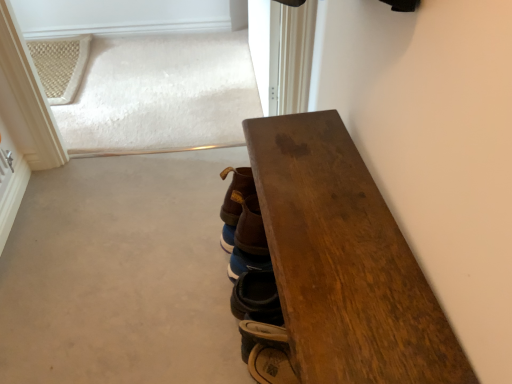
Question: From the image's perspective, is wooden table at right located above or below brown leather boot at lower center, which ranks as the 2th footwear in top-to-bottom order?

Choices:
 (A) above
 (B) below

Answer: (B)

Question: From a real-world perspective, is wooden table at right above or below brown leather boot at lower center, which appears as the 1th footwear when ordered from the bottom?

Choices:
 (A) above
 (B) below

Answer: (A)

Question: Which object is positioned closest to the brown leather boot at center, marked as the 2th footwear in a bottom-to-top arrangement?

Choices:
 (A) brown leather boot at lower center, which appears as the 1th footwear when ordered from the bottom
 (B) wooden table at right

Answer: (A)

Question: Which object is positioned farthest from the wooden table at right?

Choices:
 (A) brown leather boot at center, marked as the first footwear in a top-to-bottom arrangement
 (B) brown leather boot at lower center, which appears as the 1th footwear when ordered from the bottom

Answer: (B)